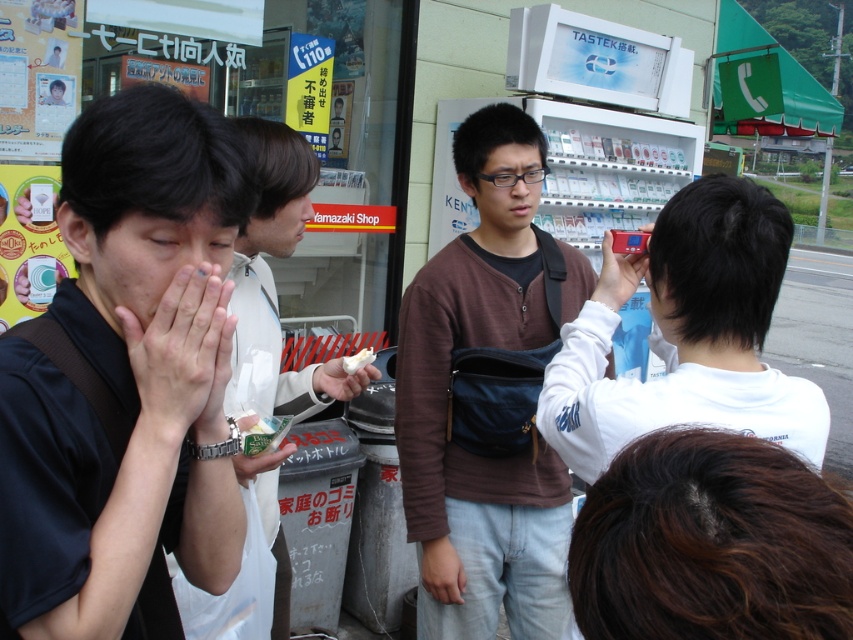
You are a photographer trying to capture a candid shot of the group. You have a matte black camera at right and a white matte paper at center. Which object should you use to frame your shot if you want something taller than the other object?

You should use the matte black camera at right to frame your shot since it is much taller than the white matte paper at center.